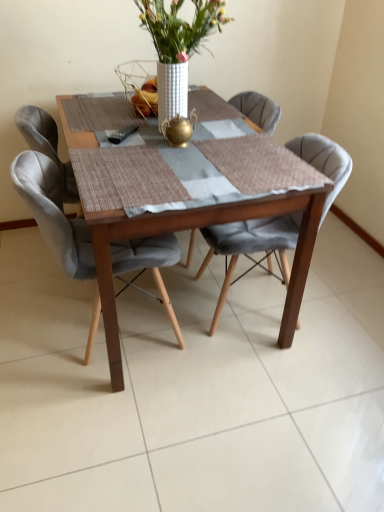
Question: From the image's perspective, is wooden table at center positioned above or below velvet grey chair at center, the 1th chair viewed from the left?

Choices:
 (A) below
 (B) above

Answer: (B)

Question: From a real-world perspective, is wooden table at center above or below velvet grey chair at center, the 1th chair viewed from the left?

Choices:
 (A) below
 (B) above

Answer: (A)

Question: Which object is positioned farthest from the velvet grey chair at center, the second chair in the right-to-left sequence?

Choices:
 (A) velvet grey chair at center, which is the second chair from left to right
 (B) wooden table at center
 (C) white textured vase at center

Answer: (C)

Question: Estimate the real-world distances between objects in this image. Which object is closer to the velvet grey chair at center, the 1th chair viewed from the right?

Choices:
 (A) white textured vase at center
 (B) velvet grey chair at center, the 1th chair viewed from the left
 (C) wooden table at center

Answer: (C)